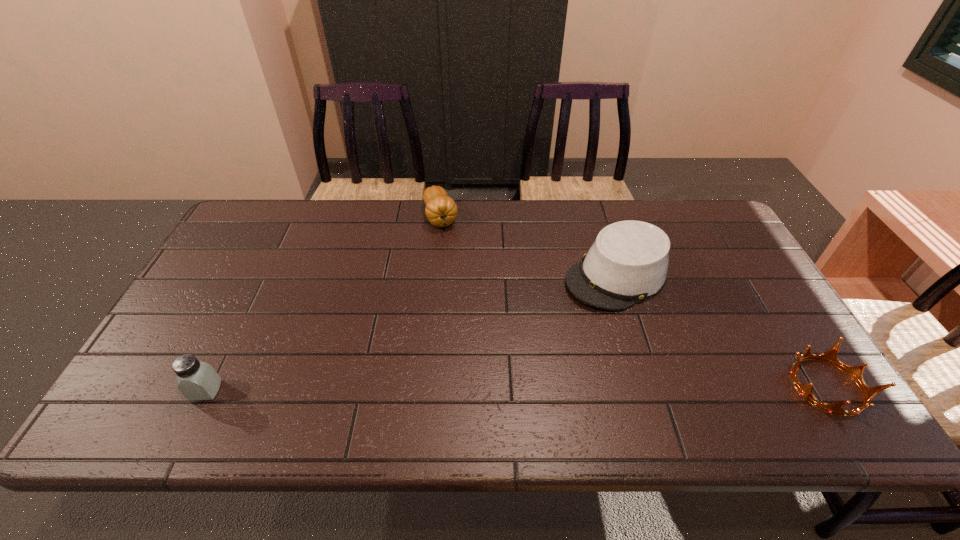
I want to click on the leftmost object, so (197, 380).

At what (x,y) coordinates should I click in order to perform the action: click on the shortest object. Please return your answer as a coordinate pair (x, y). This screenshot has height=540, width=960. Looking at the image, I should click on (855, 372).

The height and width of the screenshot is (540, 960). Find the location of `crown`. crown is located at coordinates (855, 372).

At what (x,y) coordinates should I click in order to perform the action: click on the third object from left to right. Please return your answer as a coordinate pair (x, y). Looking at the image, I should click on (628, 262).

Image resolution: width=960 pixels, height=540 pixels. I want to click on hat, so click(628, 262).

Locate an element on the screen. This screenshot has height=540, width=960. the farthest object is located at coordinates (441, 210).

Locate an element on the screen. The width and height of the screenshot is (960, 540). gourd is located at coordinates (441, 210).

The height and width of the screenshot is (540, 960). I want to click on free space located 0.160m on the right of the saltshaker, so click(289, 390).

Image resolution: width=960 pixels, height=540 pixels. What are the coordinates of `vacant space located on the back of the crown` in the screenshot? It's located at (739, 247).

Locate an element on the screen. The width and height of the screenshot is (960, 540). blank space located on the front-facing side of the third object from left to right is located at coordinates (466, 367).